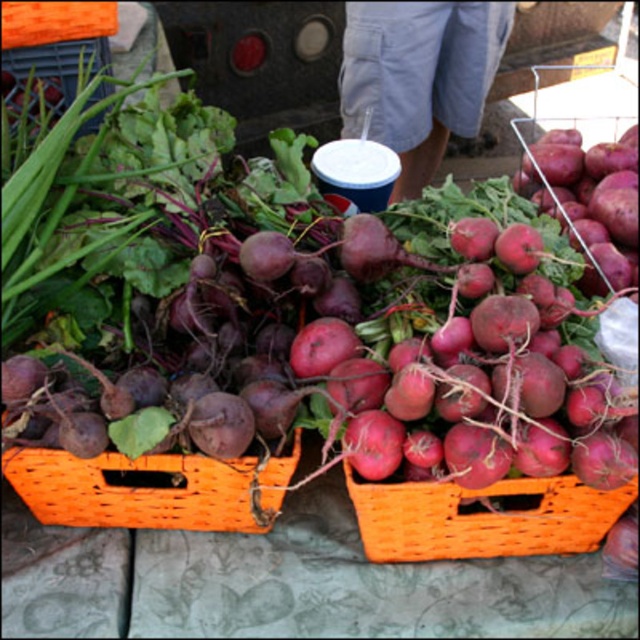
You are a delivery person who needs to place a blue plastic cup between the orange wicker basket at center and the orange woven basket at center. Can the cup fit in the space between them?

The distance between the orange wicker basket at center and the orange woven basket at center is 12.00 inches, so the blue plastic cup can fit in the space between them.